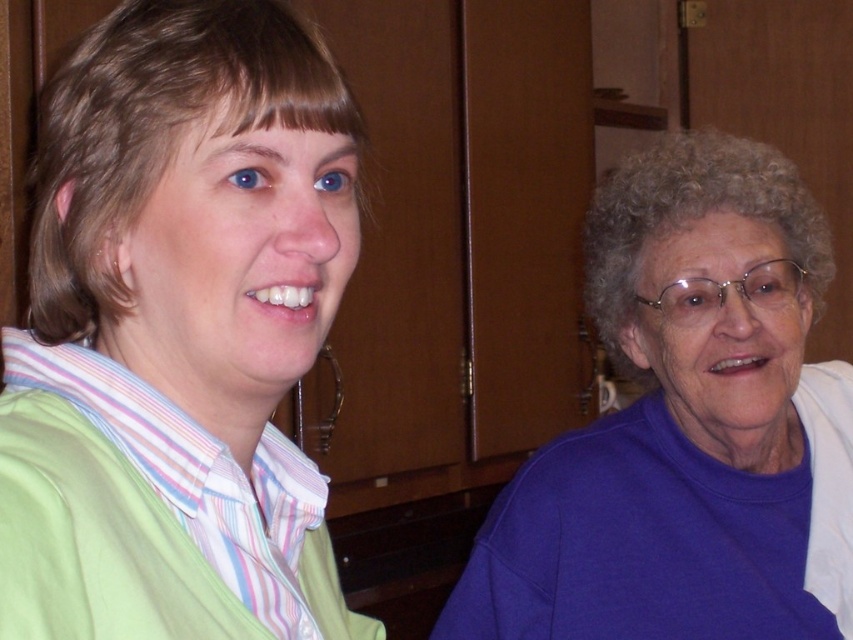
Question: Does purple matte sweater at center appear under purple matte sweater at right?

Choices:
 (A) no
 (B) yes

Answer: (A)

Question: Which object appears farthest from the camera in this image?

Choices:
 (A) purple matte sweater at right
 (B) purple matte sweater at center

Answer: (A)

Question: In this image, where is purple matte sweater at center located relative to purple matte sweater at right?

Choices:
 (A) below
 (B) above

Answer: (B)

Question: Which of the following is the farthest from the observer?

Choices:
 (A) purple matte sweater at center
 (B) purple matte sweater at right

Answer: (B)

Question: Does purple matte sweater at center lie in front of purple matte sweater at right?

Choices:
 (A) yes
 (B) no

Answer: (A)